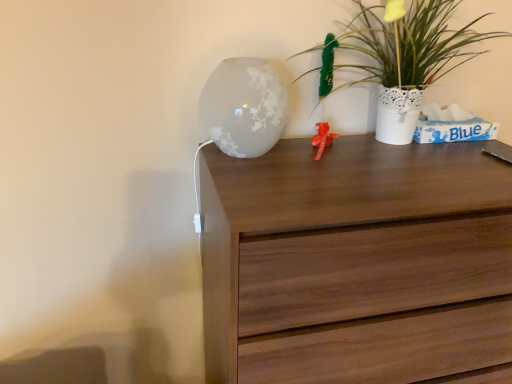
Question: Does walnut wood chest of drawers at center appear on the right side of white textured vase at upper right?

Choices:
 (A) yes
 (B) no

Answer: (B)

Question: Does walnut wood chest of drawers at center have a greater height compared to white textured vase at upper right?

Choices:
 (A) yes
 (B) no

Answer: (A)

Question: Is walnut wood chest of drawers at center looking in the opposite direction of white textured vase at upper right?

Choices:
 (A) no
 (B) yes

Answer: (A)

Question: Is walnut wood chest of drawers at center touching white textured vase at upper right?

Choices:
 (A) yes
 (B) no

Answer: (B)

Question: From a real-world perspective, is walnut wood chest of drawers at center on white textured vase at upper right?

Choices:
 (A) yes
 (B) no

Answer: (B)

Question: Would you say walnut wood chest of drawers at center is to the left or to the right of frosted glass vase at upper center in the picture?

Choices:
 (A) left
 (B) right

Answer: (B)

Question: Considering the positions of walnut wood chest of drawers at center and frosted glass vase at upper center in the image, is walnut wood chest of drawers at center bigger or smaller than frosted glass vase at upper center?

Choices:
 (A) big
 (B) small

Answer: (A)

Question: Considering their positions, is walnut wood chest of drawers at center located in front of or behind frosted glass vase at upper center?

Choices:
 (A) behind
 (B) front

Answer: (B)

Question: From their relative heights in the image, would you say walnut wood chest of drawers at center is taller or shorter than frosted glass vase at upper center?

Choices:
 (A) tall
 (B) short

Answer: (A)

Question: From the image's perspective, is white textured vase at upper right positioned above or below frosted glass vase at upper center?

Choices:
 (A) below
 (B) above

Answer: (B)

Question: Looking at their shapes, would you say white textured vase at upper right is wider or thinner than frosted glass vase at upper center?

Choices:
 (A) wide
 (B) thin

Answer: (B)

Question: From a real-world perspective, is white textured vase at upper right positioned above or below frosted glass vase at upper center?

Choices:
 (A) below
 (B) above

Answer: (B)

Question: In terms of height, does white textured vase at upper right look taller or shorter compared to frosted glass vase at upper center?

Choices:
 (A) short
 (B) tall

Answer: (B)

Question: From a real-world perspective, is frosted glass vase at upper center positioned above or below walnut wood chest of drawers at center?

Choices:
 (A) above
 (B) below

Answer: (A)

Question: Would you say frosted glass vase at upper center is inside or outside walnut wood chest of drawers at center?

Choices:
 (A) inside
 (B) outside

Answer: (B)